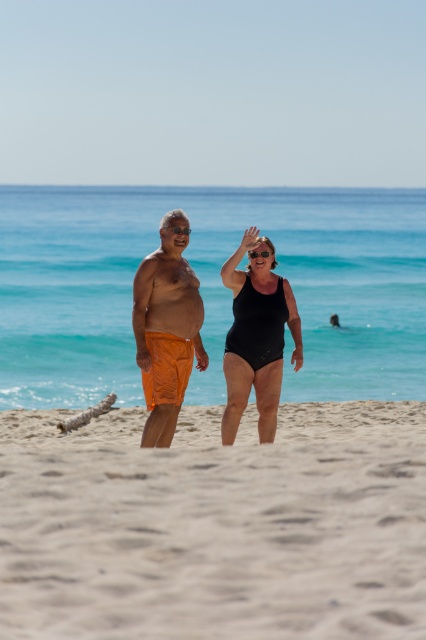
Is orange fabric shorts at left thinner than clear plastic goggles at center?

Incorrect, orange fabric shorts at left's width is not less than clear plastic goggles at center's.

Is orange fabric shorts at left taller than clear plastic goggles at center?

Correct, orange fabric shorts at left is much taller as clear plastic goggles at center.

Where is `orange fabric shorts at left`? orange fabric shorts at left is located at coordinates (256, 337).

Which is behind, point (282, 340) or point (235, 378)?

The point (282, 340) is more distant.

Between orange fabric shorts at left and black matte swimsuit at center, which one appears on the right side from the viewer's perspective?

Positioned to the right is black matte swimsuit at center.

The height and width of the screenshot is (640, 426). I want to click on orange fabric shorts at left, so click(256, 337).

Is the position of orange fabric shorts at center more distant than that of clear plastic goggles at center?

That is False.

Is orange fabric shorts at center closer to the viewer compared to clear plastic goggles at center?

Yes.

This screenshot has width=426, height=640. What are the coordinates of `orange fabric shorts at center` in the screenshot? It's located at (166, 330).